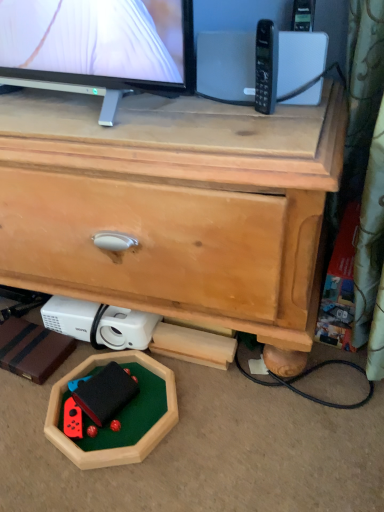
Question: Considering the relative sizes of rubberized black toy at lower center and white plastic projector at lower left in the image provided, is rubberized black toy at lower center shorter than white plastic projector at lower left?

Choices:
 (A) yes
 (B) no

Answer: (A)

Question: Could you tell me if rubberized black toy at lower center is facing white plastic projector at lower left?

Choices:
 (A) yes
 (B) no

Answer: (B)

Question: Would you say rubberized black toy at lower center is a long distance from white plastic projector at lower left?

Choices:
 (A) no
 (B) yes

Answer: (A)

Question: Is rubberized black toy at lower center facing away from white plastic projector at lower left?

Choices:
 (A) no
 (B) yes

Answer: (B)

Question: Is rubberized black toy at lower center closer to the viewer compared to white plastic projector at lower left?

Choices:
 (A) no
 (B) yes

Answer: (B)

Question: Considering the relative sizes of rubberized black toy at lower center and white plastic projector at lower left in the image provided, is rubberized black toy at lower center taller than white plastic projector at lower left?

Choices:
 (A) yes
 (B) no

Answer: (B)

Question: Is the position of rubberized black toy at lower center less distant than that of black plastic phone at upper right?

Choices:
 (A) no
 (B) yes

Answer: (A)

Question: Is rubberized black toy at lower center directly adjacent to black plastic phone at upper right?

Choices:
 (A) no
 (B) yes

Answer: (A)

Question: From the image's perspective, is rubberized black toy at lower center located above black plastic phone at upper right?

Choices:
 (A) yes
 (B) no

Answer: (B)

Question: Can you confirm if rubberized black toy at lower center is positioned to the right of black plastic phone at upper right?

Choices:
 (A) yes
 (B) no

Answer: (B)

Question: Is black plastic phone at upper right at the back of rubberized black toy at lower center?

Choices:
 (A) no
 (B) yes

Answer: (A)

Question: Considering the relative sizes of rubberized black toy at lower center and black plastic phone at upper right in the image provided, is rubberized black toy at lower center wider than black plastic phone at upper right?

Choices:
 (A) yes
 (B) no

Answer: (A)

Question: Is wooden chest of drawers at center wider than rubberized black toy at lower center?

Choices:
 (A) no
 (B) yes

Answer: (B)